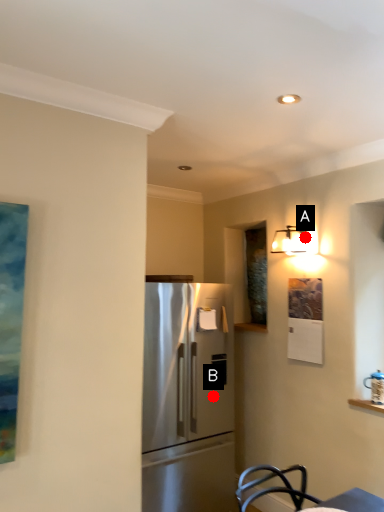
Question: Two points are circled on the image, labeled by A and B beside each circle. Which of the following is the farthest from the observer?

Choices:
 (A) A is further
 (B) B is further

Answer: (B)